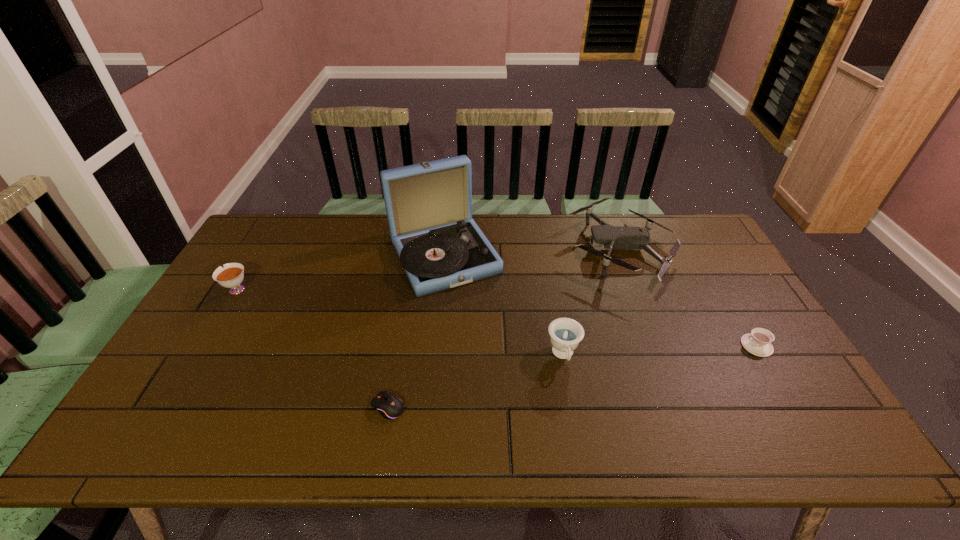
Where is `object situated at the near edge`? object situated at the near edge is located at coordinates (389, 406).

The image size is (960, 540). I want to click on object positioned at the left edge, so click(231, 276).

Find the location of a particular element. This screenshot has width=960, height=540. drone at the right edge is located at coordinates (611, 237).

Image resolution: width=960 pixels, height=540 pixels. I want to click on teacup located at the right edge, so click(758, 342).

Identify the location of object positioned at the far right corner. (611, 237).

The width and height of the screenshot is (960, 540). In order to click on vacant space at the far edge in this screenshot , I will do `click(543, 214)`.

The image size is (960, 540). I want to click on free location at the near edge, so click(467, 448).

Locate an element on the screen. This screenshot has height=540, width=960. vacant space at the left edge of the desktop is located at coordinates (248, 291).

Image resolution: width=960 pixels, height=540 pixels. In the image, there is a desktop. Find the location of `vacant space at the right edge`. vacant space at the right edge is located at coordinates (705, 285).

You are a GUI agent. You are given a task and a screenshot of the screen. Output one action in this format:
    pyautogui.click(x=<x>, y=<y>)
    Task: Click on the free space at the far left corner of the desktop
    The width and height of the screenshot is (960, 540).
    Given the screenshot: What is the action you would take?
    pyautogui.click(x=271, y=228)